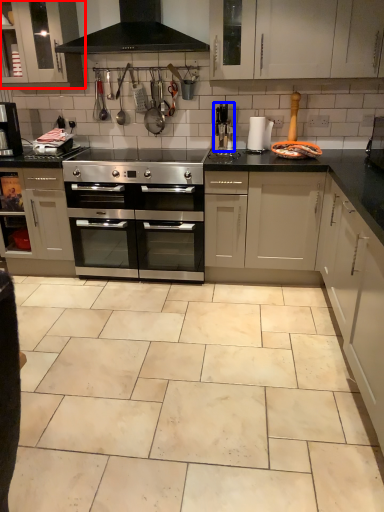
Question: Among these objects, which one is farthest to the camera, cabinetry (highlighted by a red box) or appliance (highlighted by a blue box)?

Choices:
 (A) cabinetry
 (B) appliance

Answer: (B)